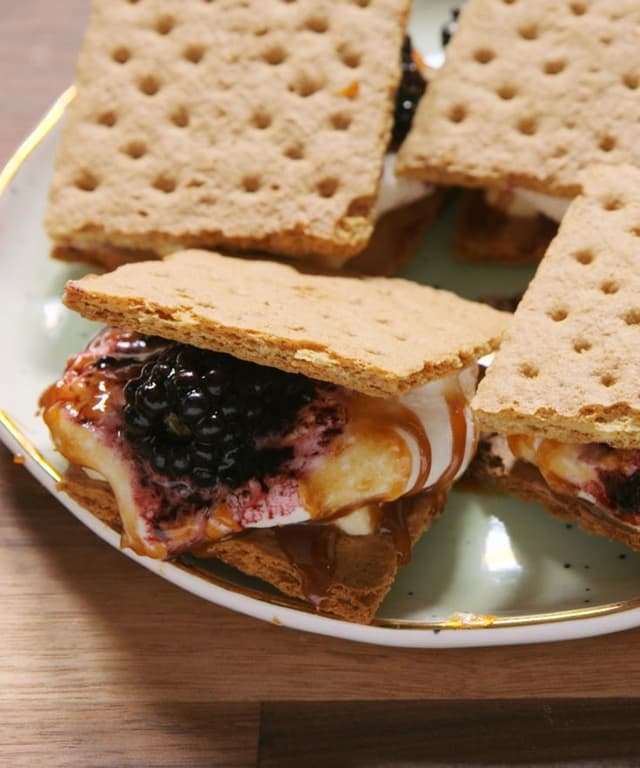
Image resolution: width=640 pixels, height=768 pixels. I want to click on plate, so click(36, 171).